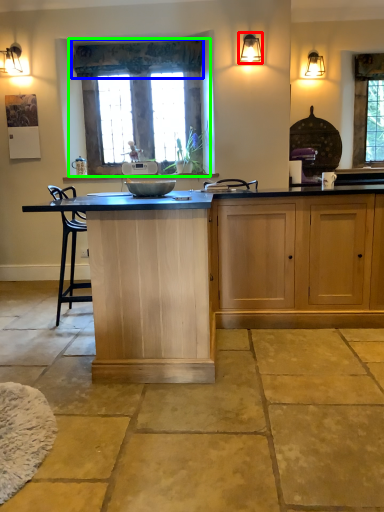
Question: Considering the real-world distances, which object is farthest from light fixture (highlighted by a red box)? curtain (highlighted by a blue box) or window (highlighted by a green box)?

Choices:
 (A) curtain
 (B) window

Answer: (B)